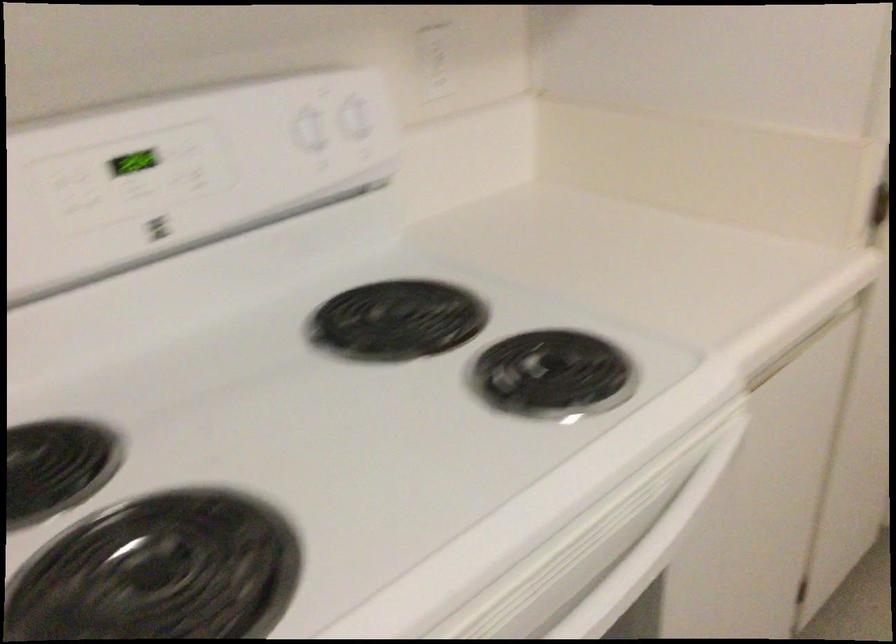
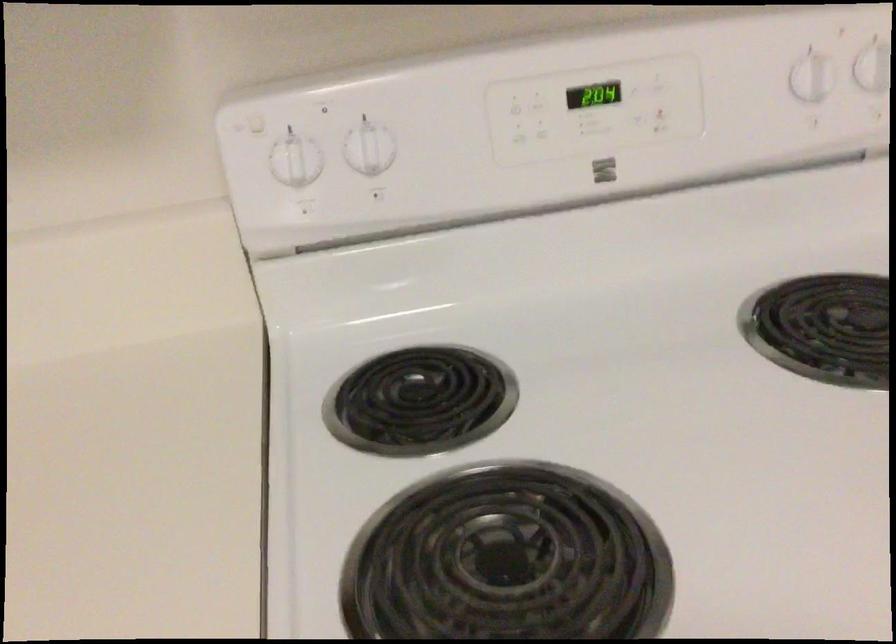
Find the pixel in the second image that matches [99,205] in the first image.

(543, 129)